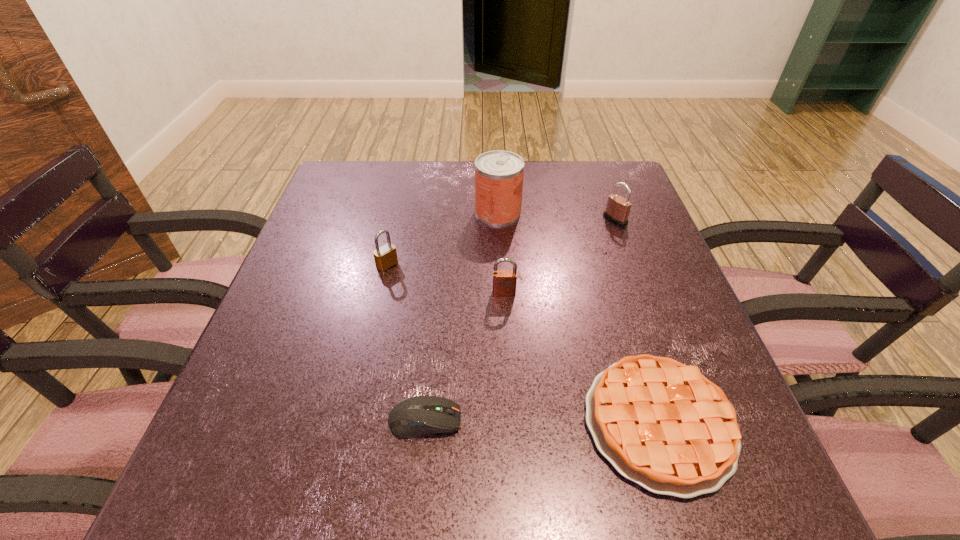
This screenshot has width=960, height=540. I want to click on can, so click(x=499, y=174).

What are the coordinates of `the rightmost padlock` in the screenshot? It's located at (617, 210).

You are a GUI agent. You are given a task and a screenshot of the screen. Output one action in this format:
    pyautogui.click(x=<x>, y=<y>)
    Task: Click on the leftmost object
    The image size is (960, 540).
    Given the screenshot: What is the action you would take?
    pyautogui.click(x=385, y=256)

Identify the location of the leftmost padlock. This screenshot has height=540, width=960. (385, 256).

This screenshot has width=960, height=540. Find the location of `the second padlock from right to left`. the second padlock from right to left is located at coordinates (504, 281).

Where is `the nearest padlock`? the nearest padlock is located at coordinates (504, 281).

You are a GUI agent. You are given a task and a screenshot of the screen. Output one action in this format:
    pyautogui.click(x=<x>, y=<y>)
    Task: Click on the pie
    
    Given the screenshot: What is the action you would take?
    pyautogui.click(x=663, y=425)

Identify the location of computer equipment. The width and height of the screenshot is (960, 540). (414, 416).

This screenshot has height=540, width=960. In order to click on free spot located on the back of the can in this screenshot , I will do `click(496, 173)`.

Find the location of a particular element. This screenshot has width=960, height=540. vacant space located 0.150m on the back of the rightmost padlock is located at coordinates (601, 181).